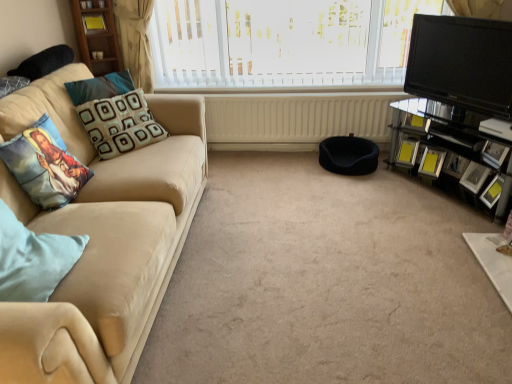
Find the location of `free spot to the left of black glossy entertainment center at right`. free spot to the left of black glossy entertainment center at right is located at coordinates (381, 198).